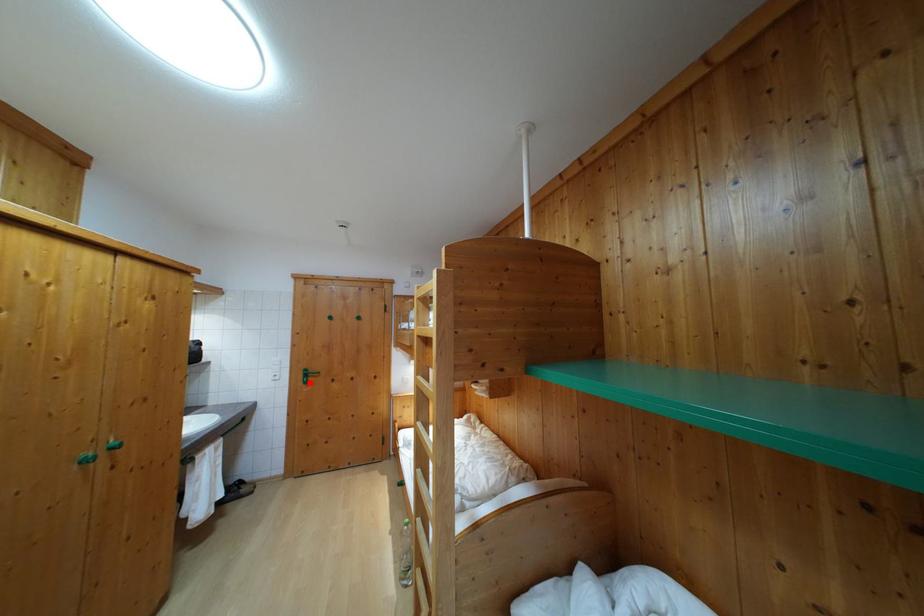
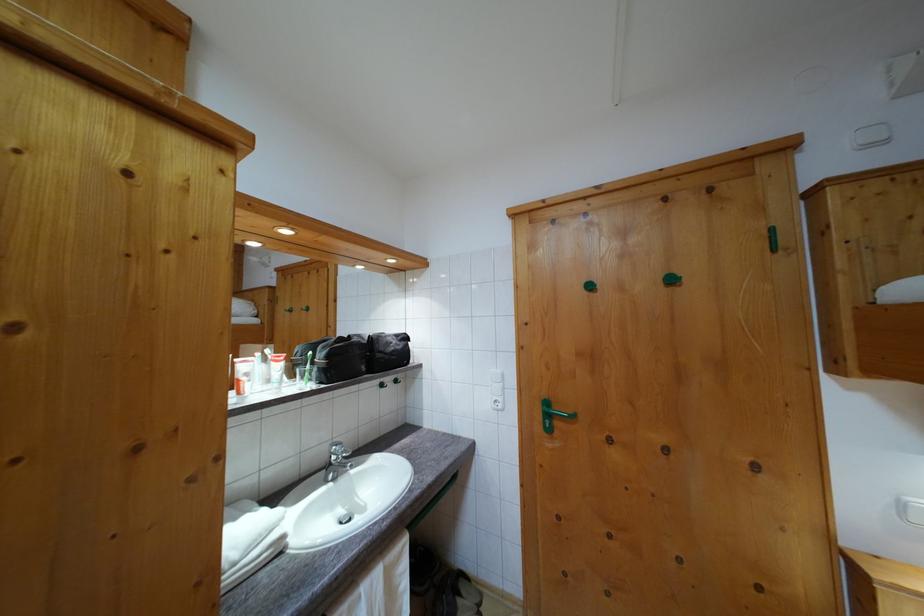
Question: I am providing you with two images of the same scene from different viewpoints. A red point is shown in image1. For the corresponding object point in image2, is it positioned nearer or farther from the camera?

Choices:
 (A) Nearer
 (B) Farther

Answer: (B)